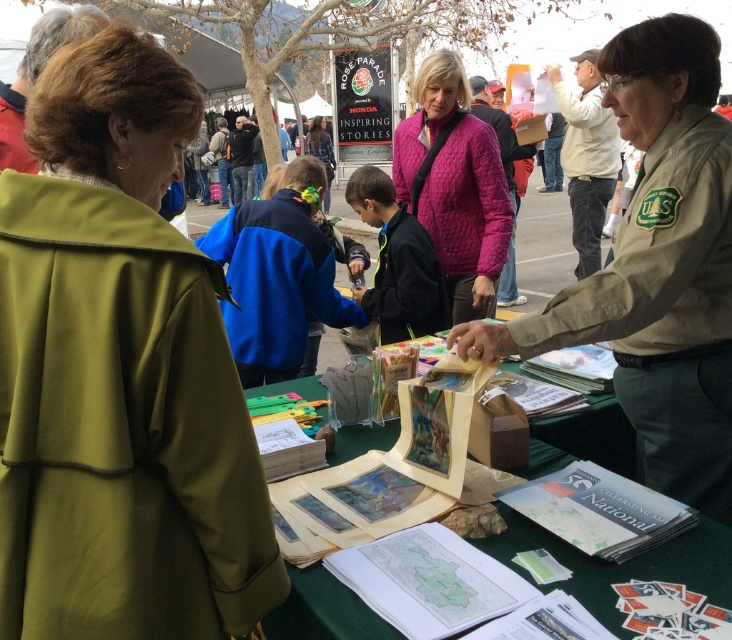
You are organizing a community event and need to place a 2 meter long banner between the matte olive green coat at left and the black matte jacket at center. Will there be enough space?

The matte olive green coat at left and the black matte jacket at center are 1.94 meters apart from each other, so the 2 meter long banner will not fit between them as the distance is slightly shorter than the banner length.

You are organizing an outdoor event and need to display two jackets on a table. The blue fleece jacket at center and the black matte jacket at center must be placed side by side. If the table has a width of 1.2 meters, will both jackets fit without overlapping?

The blue fleece jacket at center is wider than the black matte jacket at center. Since the blue jacket is wider, but the total width of both jackets combined is not specified, we cannot definitively determine if they will fit on the 1.2 meters table without overlapping. More information about their individual widths is needed.

What is the color of the object located at point (119, 374)?

The object at point (119, 374) is the matte olive green coat at left.